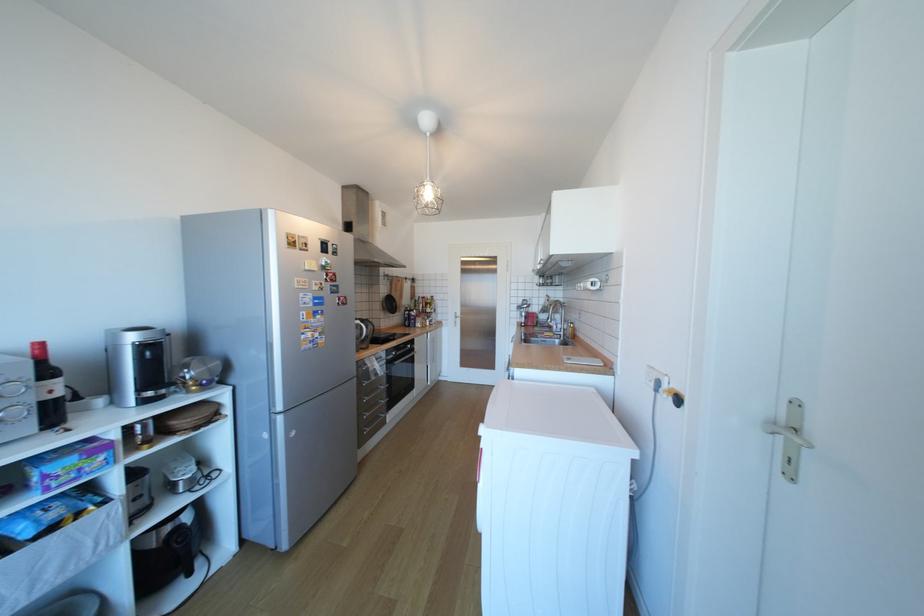
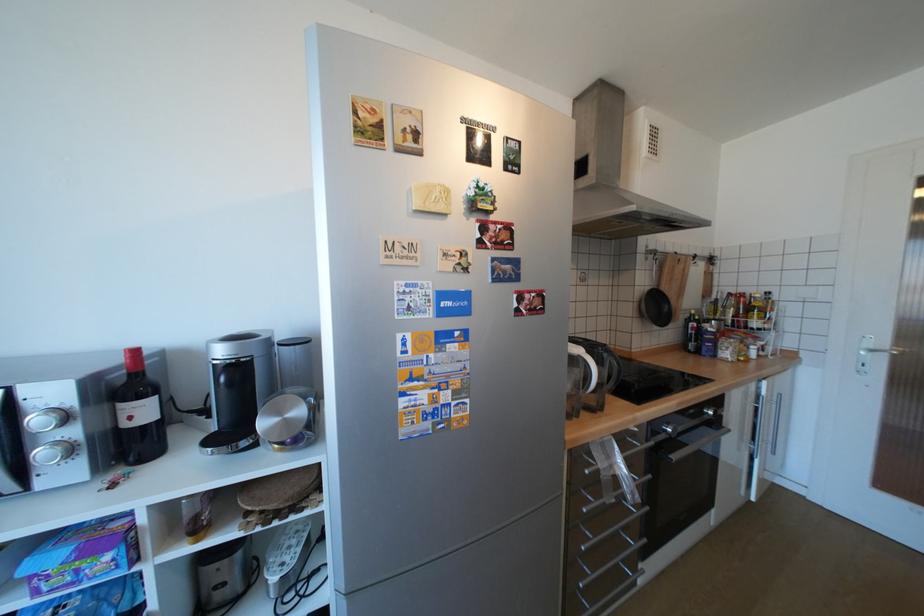
Find the pixel in the second image that matches (390,373) in the first image.

(641, 493)